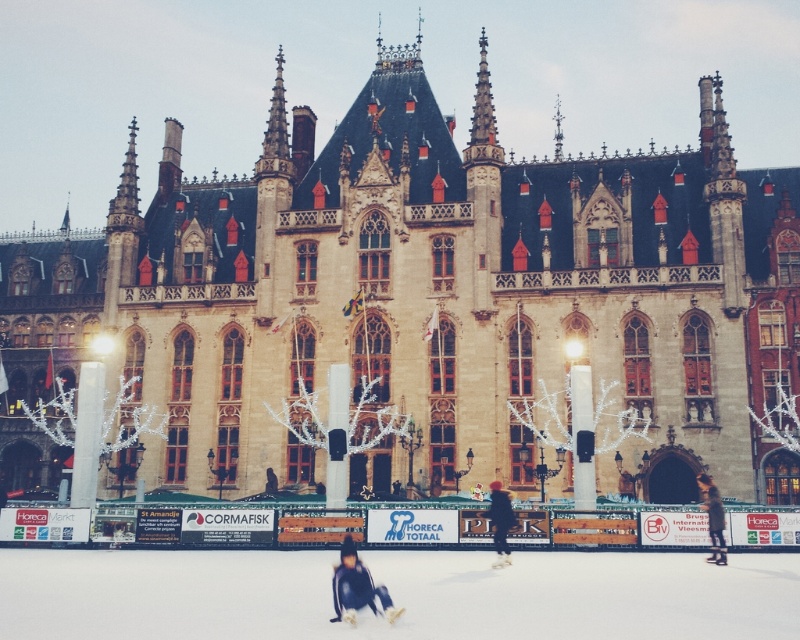
Question: Which of the following is the farthest from the observer?

Choices:
 (A) dark blue jacket at center
 (B) dark blue fabric at center

Answer: (A)

Question: Estimate the real-world distances between objects in this image. Which object is closer to the dark brown leather jacket at lower right?

Choices:
 (A) dark blue fabric at center
 (B) dark blue jacket at center

Answer: (B)

Question: Among these points, which one is farthest from the camera?

Choices:
 (A) (x=336, y=573)
 (B) (x=709, y=497)

Answer: (B)

Question: Is dark blue jacket at center bigger than dark brown leather jacket at lower right?

Choices:
 (A) no
 (B) yes

Answer: (A)

Question: Is dark blue jacket at center bigger than dark brown leather jacket at lower right?

Choices:
 (A) no
 (B) yes

Answer: (A)

Question: Does dark blue jacket at center come behind dark brown leather jacket at lower right?

Choices:
 (A) yes
 (B) no

Answer: (B)